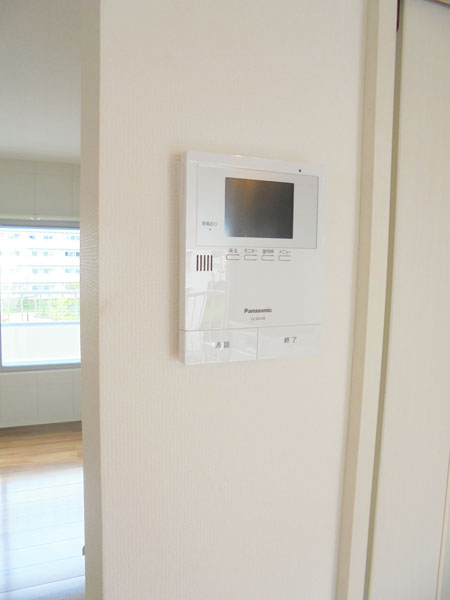
The image size is (450, 600). I want to click on wall, so click(x=260, y=421).